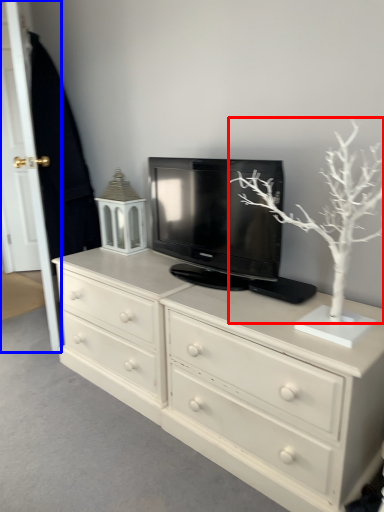
Question: Which object is closer to the camera taking this photo, tree (highlighted by a red box) or door (highlighted by a blue box)?

Choices:
 (A) tree
 (B) door

Answer: (A)